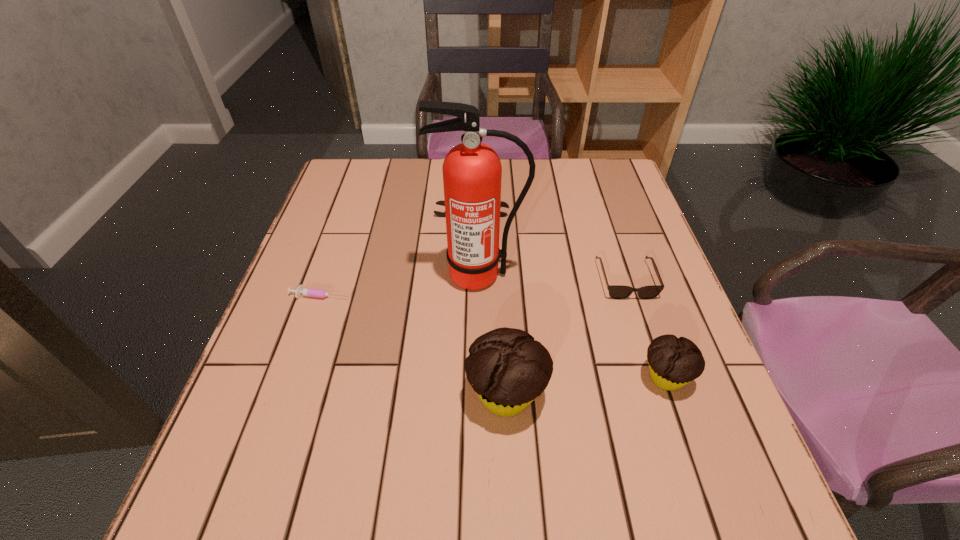
What are the coordinates of `the second tallest object` in the screenshot? It's located at (507, 368).

Find the location of a particular element. Image resolution: width=960 pixels, height=540 pixels. the left muffin is located at coordinates (507, 368).

I want to click on the fourth shortest object, so click(674, 362).

Locate an element on the screen. Image resolution: width=960 pixels, height=540 pixels. the right muffin is located at coordinates (674, 362).

Identify the location of wrench. This screenshot has height=540, width=960. click(x=503, y=204).

The image size is (960, 540). I want to click on fire extinguisher, so click(x=472, y=172).

The height and width of the screenshot is (540, 960). What are the coordinates of `syringe` in the screenshot? It's located at (301, 291).

The image size is (960, 540). In order to click on the leftmost object in this screenshot , I will do `click(301, 291)`.

Identify the location of the fifth tallest object. This screenshot has width=960, height=540. (618, 292).

In order to click on free point located on the back of the taller muffin in this screenshot , I will do `click(503, 322)`.